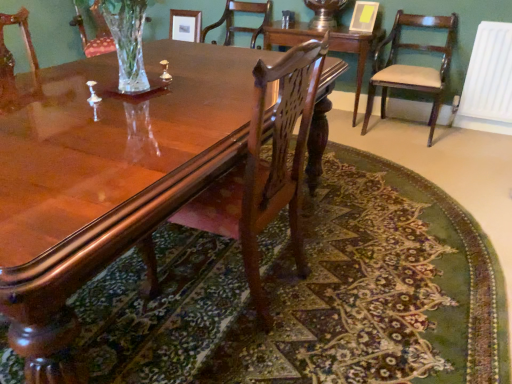
Question: Can you confirm if white plastic radiator at right is bigger than glossy wood coffee table at center?

Choices:
 (A) yes
 (B) no

Answer: (B)

Question: Does white plastic radiator at right have a greater height compared to glossy wood coffee table at center?

Choices:
 (A) yes
 (B) no

Answer: (A)

Question: Is the position of white plastic radiator at right less distant than that of glossy wood coffee table at center?

Choices:
 (A) no
 (B) yes

Answer: (A)

Question: Does white plastic radiator at right turn towards glossy wood coffee table at center?

Choices:
 (A) no
 (B) yes

Answer: (A)

Question: Is white plastic radiator at right not within glossy wood coffee table at center?

Choices:
 (A) no
 (B) yes

Answer: (B)

Question: From the image's perspective, is polished wood chair at center, placed as the first chair when sorted from front to back, above or below white plastic radiator at right?

Choices:
 (A) below
 (B) above

Answer: (A)

Question: Does point (312, 52) appear closer or farther from the camera than point (485, 130)?

Choices:
 (A) farther
 (B) closer

Answer: (B)

Question: Is polished wood chair at center, placed as the first chair when sorted from front to back, wider or thinner than white plastic radiator at right?

Choices:
 (A) thin
 (B) wide

Answer: (B)

Question: Would you say polished wood chair at center, the second chair when ordered from right to left, is to the left or to the right of white plastic radiator at right in the picture?

Choices:
 (A) left
 (B) right

Answer: (A)

Question: From a real-world perspective, is polished wood chair at center, placed as the first chair when sorted from front to back, physically located above or below mahogany wood table at center?

Choices:
 (A) above
 (B) below

Answer: (A)

Question: From the image's perspective, is polished wood chair at center, which appears as the 3th chair when viewed from the back, located above or below mahogany wood table at center?

Choices:
 (A) below
 (B) above

Answer: (A)

Question: Is polished wood chair at center, placed as the first chair when sorted from front to back, wider or thinner than mahogany wood table at center?

Choices:
 (A) wide
 (B) thin

Answer: (A)

Question: Is polished wood chair at center, the second chair when ordered from right to left, inside or outside of mahogany wood table at center?

Choices:
 (A) inside
 (B) outside

Answer: (B)

Question: Would you say polished wood chair at center, the second chair when ordered from right to left, is to the left or to the right of glossy wood coffee table at center in the picture?

Choices:
 (A) right
 (B) left

Answer: (A)

Question: Is polished wood chair at center, the second chair when ordered from right to left, bigger or smaller than glossy wood coffee table at center?

Choices:
 (A) big
 (B) small

Answer: (B)